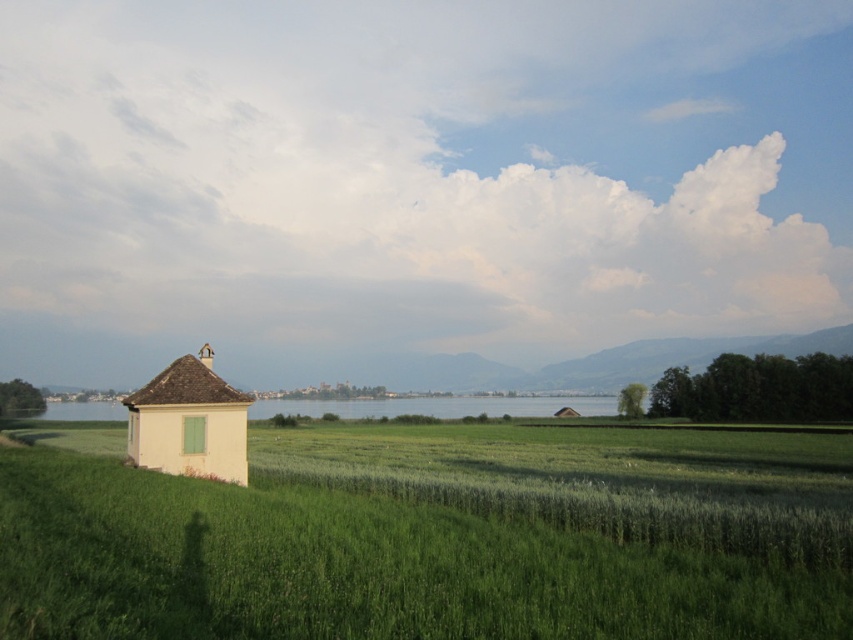
Based on the photo, you are standing at the center of the image and want to locate the white matte hut at left. According to the coordinates provided, in which direction should you look to find it?

The white matte hut at left is located at coordinates point (189, 422), which means it is positioned to the left side of the image. Therefore, you should look to the left to find it.